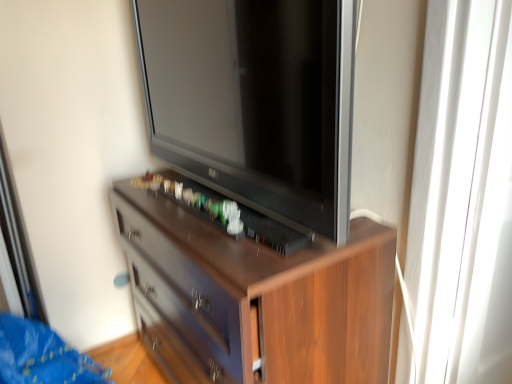
Question: Is transparent glass door at right at the right side of brown wood chest of drawers at center?

Choices:
 (A) no
 (B) yes

Answer: (B)

Question: Is brown wood chest of drawers at center inside transparent glass door at right?

Choices:
 (A) yes
 (B) no

Answer: (B)

Question: From the image's perspective, is transparent glass door at right located beneath brown wood chest of drawers at center?

Choices:
 (A) no
 (B) yes

Answer: (A)

Question: Can you confirm if transparent glass door at right is positioned to the left of brown wood chest of drawers at center?

Choices:
 (A) no
 (B) yes

Answer: (A)

Question: Considering the relative sizes of transparent glass door at right and brown wood chest of drawers at center in the image provided, is transparent glass door at right bigger than brown wood chest of drawers at center?

Choices:
 (A) yes
 (B) no

Answer: (B)

Question: Is transparent glass door at right positioned beyond the bounds of brown wood chest of drawers at center?

Choices:
 (A) no
 (B) yes

Answer: (B)

Question: Does brown wood chest of drawers at center have a lesser height compared to transparent glass door at right?

Choices:
 (A) yes
 (B) no

Answer: (A)

Question: Considering the relative sizes of brown wood chest of drawers at center and transparent glass door at right in the image provided, is brown wood chest of drawers at center wider than transparent glass door at right?

Choices:
 (A) no
 (B) yes

Answer: (B)

Question: Is transparent glass door at right a part of brown wood chest of drawers at center?

Choices:
 (A) no
 (B) yes

Answer: (A)

Question: Is brown wood chest of drawers at center to the right of transparent glass door at right from the viewer's perspective?

Choices:
 (A) no
 (B) yes

Answer: (A)

Question: From a real-world perspective, does brown wood chest of drawers at center stand above transparent glass door at right?

Choices:
 (A) yes
 (B) no

Answer: (B)

Question: From the image's perspective, does brown wood chest of drawers at center appear lower than transparent glass door at right?

Choices:
 (A) no
 (B) yes

Answer: (B)

Question: Is satin black television at center positioned far away from brown wood chest of drawers at center?

Choices:
 (A) no
 (B) yes

Answer: (A)